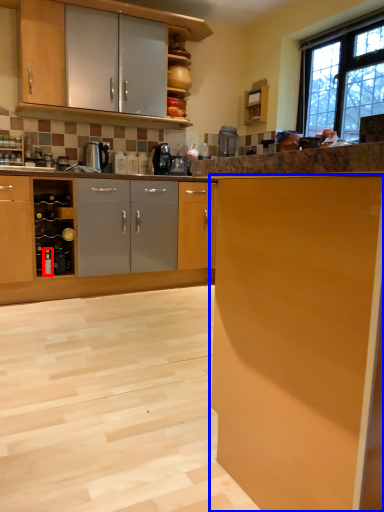
Question: Which point is further to the camera, bottle (highlighted by a red box) or cabinetry (highlighted by a blue box)?

Choices:
 (A) bottle
 (B) cabinetry

Answer: (A)